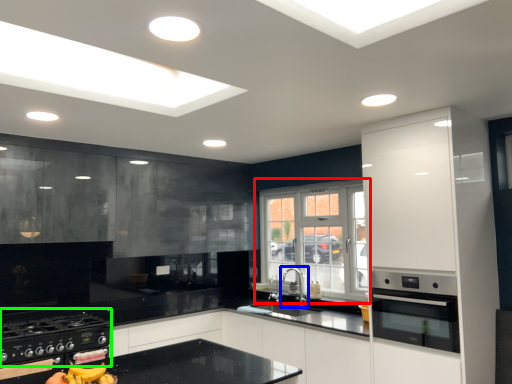
Question: Based on their relative distances, which object is farther from window (highlighted by a red box)? Choose from tap (highlighted by a blue box) and gas stove (highlighted by a green box).

Choices:
 (A) tap
 (B) gas stove

Answer: (B)